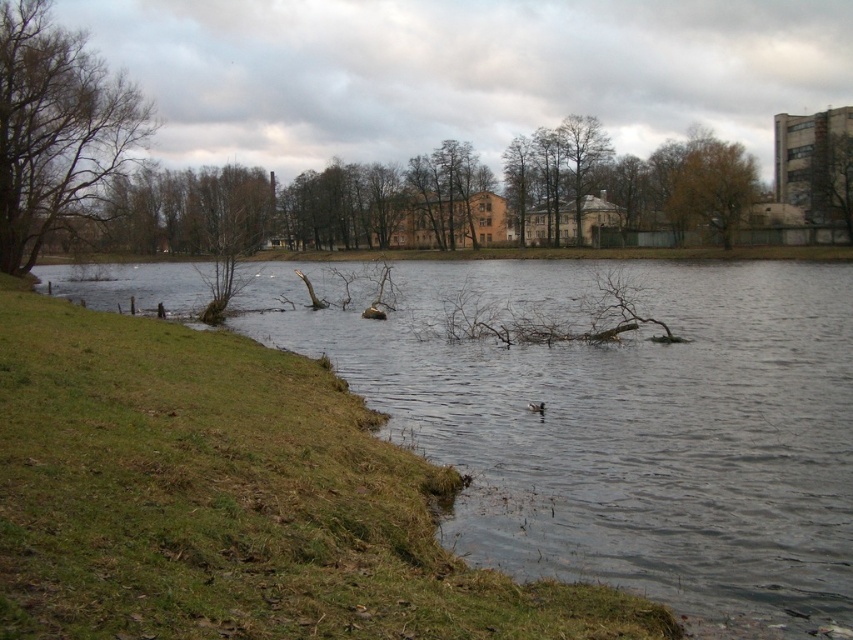
Question: Is green grass at lower left wider than brown textured tree at upper right?

Choices:
 (A) no
 (B) yes

Answer: (B)

Question: Which is farther from the green grass at lower left?

Choices:
 (A) brown textured tree at upper right
 (B) green leafy tree at upper right
 (C) brown leafless tree at left
 (D) brown matte duck at center

Answer: (D)

Question: Which object is the farthest from the brown matte duck at center?

Choices:
 (A) brown leafless tree at left
 (B) green grass at lower left
 (C) brown textured tree at upper right
 (D) green leafy tree at upper right

Answer: (D)

Question: Can you confirm if brown leafless tree at left is bigger than green leafy tree at upper right?

Choices:
 (A) no
 (B) yes

Answer: (B)

Question: Which is farther from the brown textured tree at upper right?

Choices:
 (A) green grass at lower left
 (B) brown matte duck at center

Answer: (B)

Question: Is brown textured tree at upper right bigger than brown matte duck at center?

Choices:
 (A) no
 (B) yes

Answer: (B)